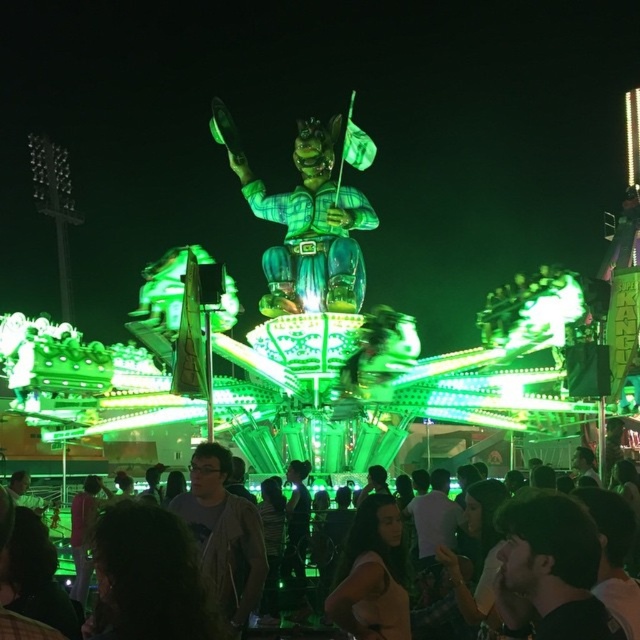
You are a photographer standing at the entrance of the fairground and want to take a photo of the gray matte jacket at center and the matte black shirt at center. Which one will appear closer to you in the photo?

The gray matte jacket at center will appear closer to you in the photo because it is in front of the matte black shirt at center.

You are a photographer at the fairground and want to capture both the dark brown hair at lower right and the dark hair at lower center in a single frame. Which of the two hair styles will appear smaller in the photo?

The dark brown hair at lower right will appear smaller in the photo because it occupies less space than the dark hair at lower center.